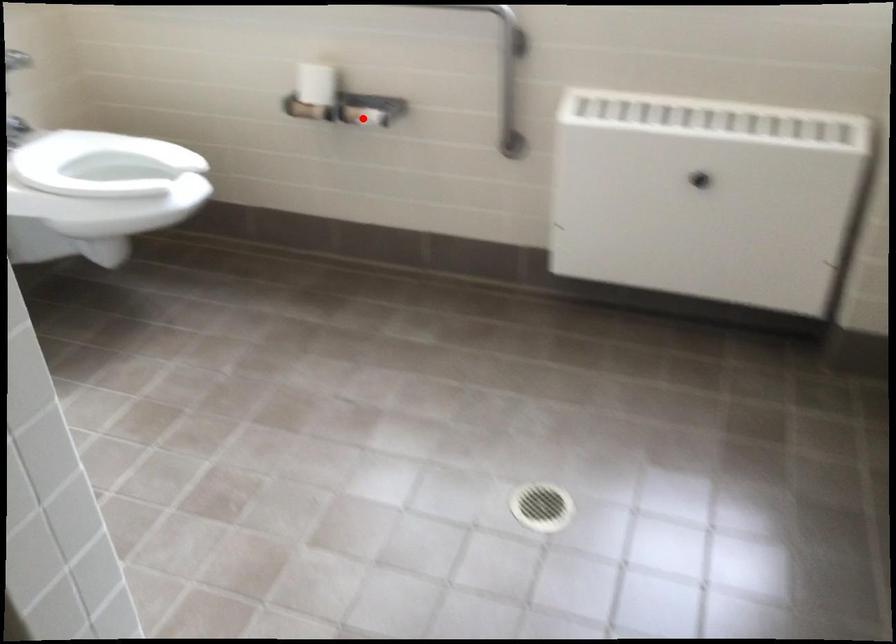
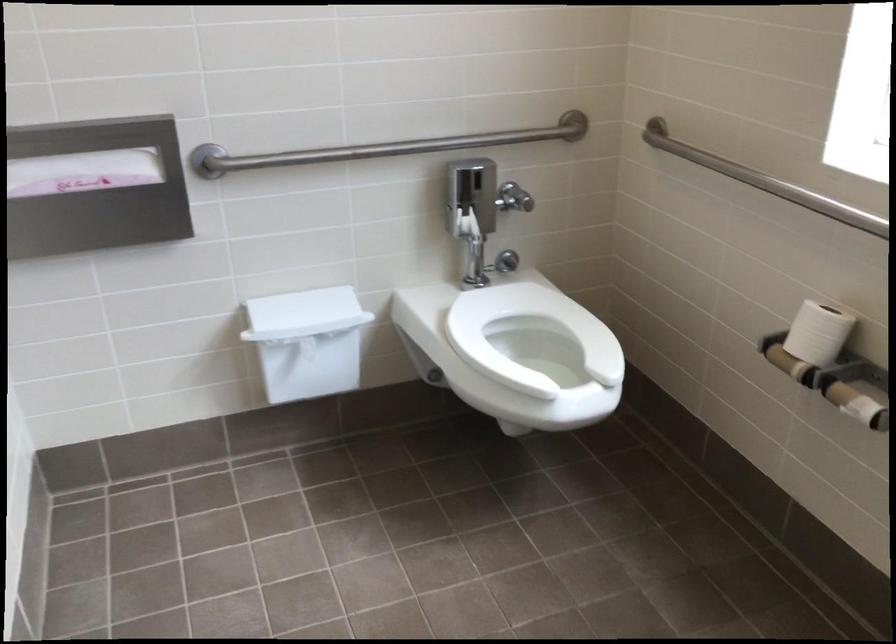
Where in the second image is the point corresponding to the highlighted location from the first image?

(857, 404)